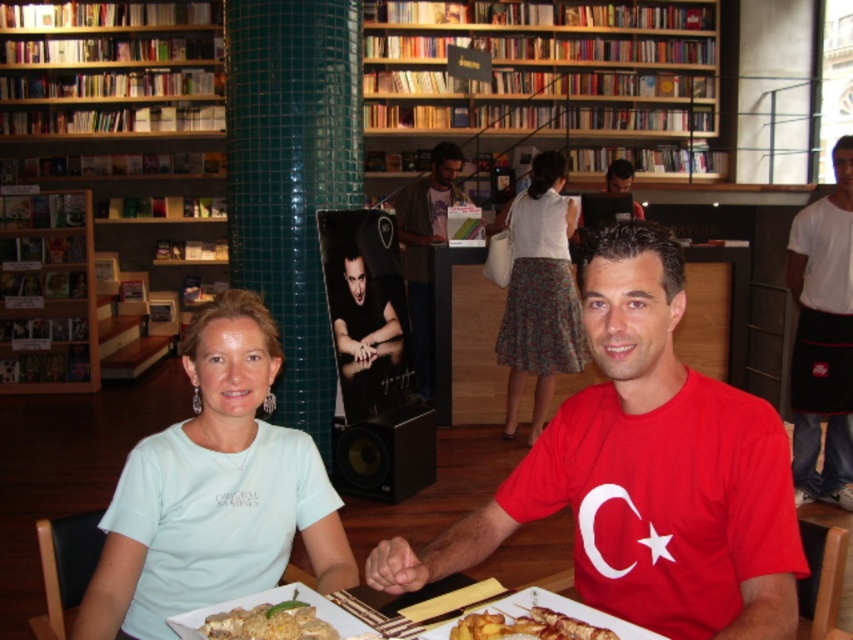
Which is in front, point (135, 531) or point (846, 428)?

Positioned in front is point (135, 531).

Can you confirm if light blue cotton shirt at center is bigger than white cotton shirt at right?

No, light blue cotton shirt at center is not bigger than white cotton shirt at right.

Identify the location of light blue cotton shirt at center. The height and width of the screenshot is (640, 853). (213, 492).

The width and height of the screenshot is (853, 640). I want to click on light blue cotton shirt at center, so click(213, 492).

Who is lower down, light blue cotton shirt at center or black matte speaker at center?

Positioned lower is black matte speaker at center.

Does light blue cotton shirt at center lie behind black matte speaker at center?

No, it is not.

Does point (144, 451) lie behind point (408, 444)?

No, it is not.

Find the location of `light blue cotton shirt at center`. light blue cotton shirt at center is located at coordinates (213, 492).

Does red cotton t-shirt at center appear on the left side of matte brown jacket at center?

No, red cotton t-shirt at center is not to the left of matte brown jacket at center.

Between point (636, 417) and point (410, 228), which one is positioned in front?

Point (636, 417)

I want to click on red cotton t-shirt at center, so click(x=645, y=472).